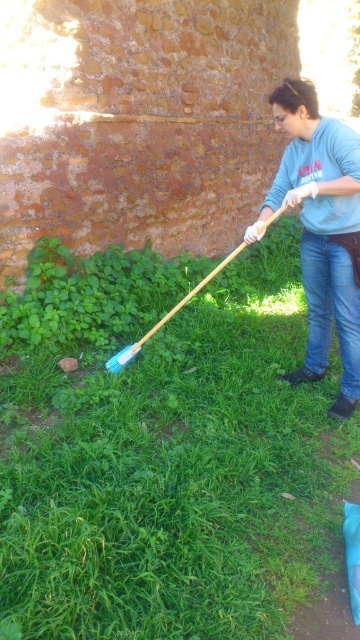
You are a gardener who needs to decide whether to mow the green grass at lower left. Since the blue cotton sweater at center is part of your uniform, will the grass be shorter than your uniform after mowing?

The green grass at lower left is already shorter than the blue cotton sweater at center, so after mowing it will be even shorter, making it shorter than your uniform.

You are standing at the origin point of the coordinate system. You see two points, point (312, 227) and point (204, 282). Which point is closer to you?

Point (312, 227) is in front of point (204, 282), so it is closer to you.

You are a gardener who needs to determine the best tool to use for clearing debris near the stone wall. Given the presence of the green grass at lower left and the blue plastic shovel at center, which object is more suitable for the task and why?

The blue plastic shovel at center is more suitable for clearing debris near the stone wall because the green grass at lower left is larger in size and might be part of the landscaping that needs to be preserved.